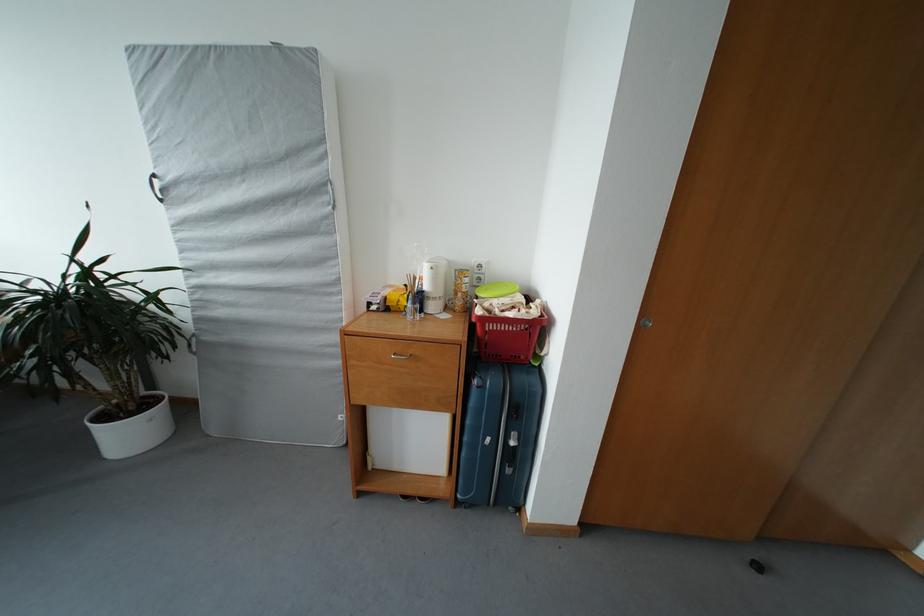
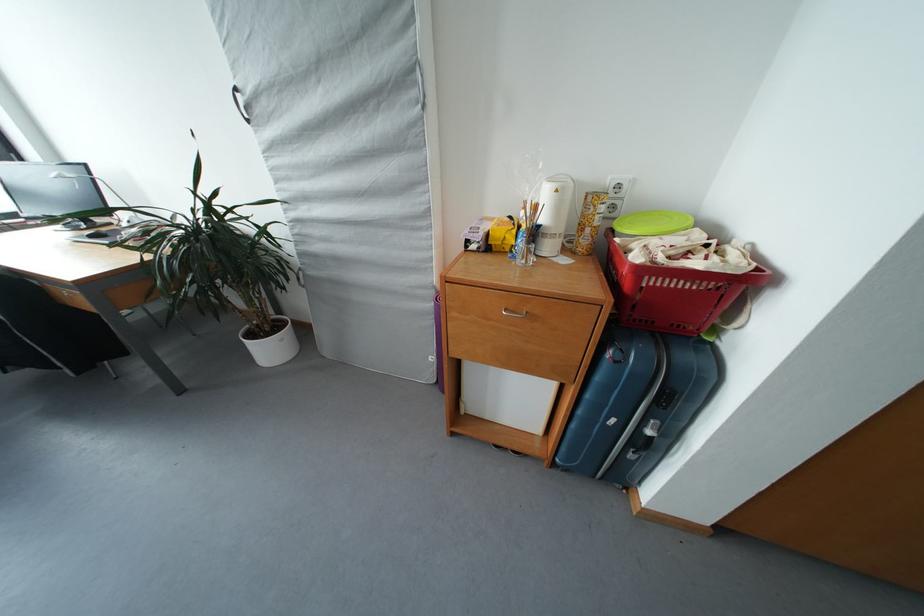
In the second image, find the point that corresponds to (x=517, y=333) in the first image.

(694, 291)